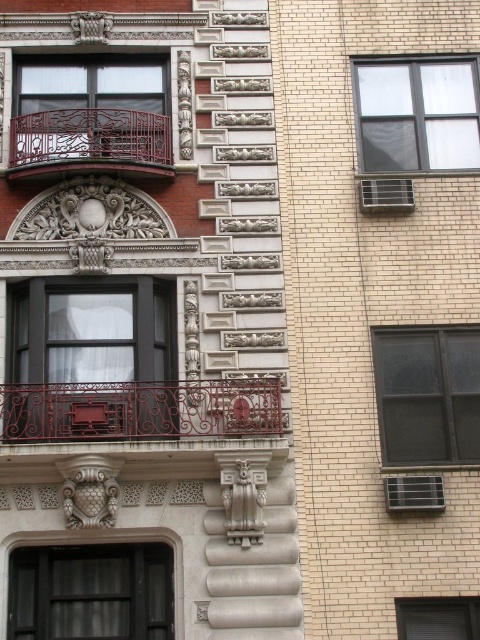
Question: Is clear glass window at upper right in front of rustic wrought iron balcony at upper left?

Choices:
 (A) yes
 (B) no

Answer: (B)

Question: Is clear glass window at center right behind rustic wrought iron balcony at upper left?

Choices:
 (A) no
 (B) yes

Answer: (A)

Question: Which point is farther to the camera?

Choices:
 (A) rusty metal railing at center
 (B) clear glass window at upper right

Answer: (B)

Question: Is rusty metal railing at center bigger than matte black balcony at left?

Choices:
 (A) no
 (B) yes

Answer: (A)

Question: Estimate the real-world distances between objects in this image. Which object is farther from the clear glass window at lower right?

Choices:
 (A) rusty metal railing at center
 (B) clear glass window at upper right

Answer: (B)

Question: Which of the following is the farthest from the observer?

Choices:
 (A) clear glass window at upper right
 (B) clear glass window at lower right
 (C) rusty metal railing at center

Answer: (A)